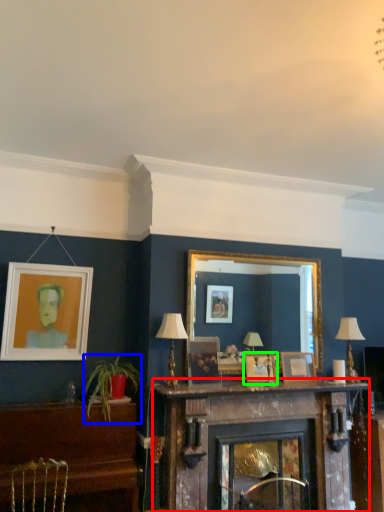
Question: Considering the real-world distances, which object is farthest from fireplace (highlighted by a red box)? houseplant (highlighted by a blue box) or picture frame (highlighted by a green box)?

Choices:
 (A) houseplant
 (B) picture frame

Answer: (A)